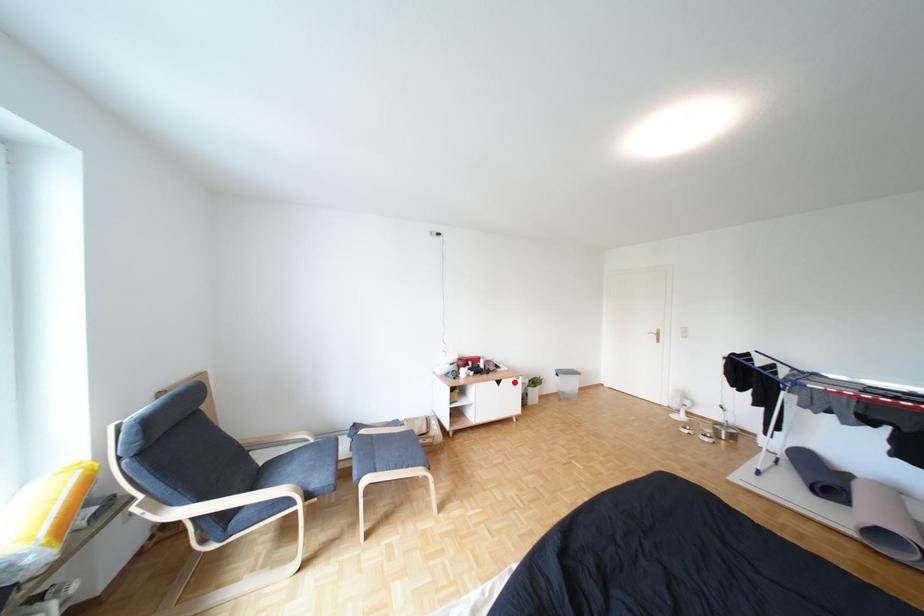
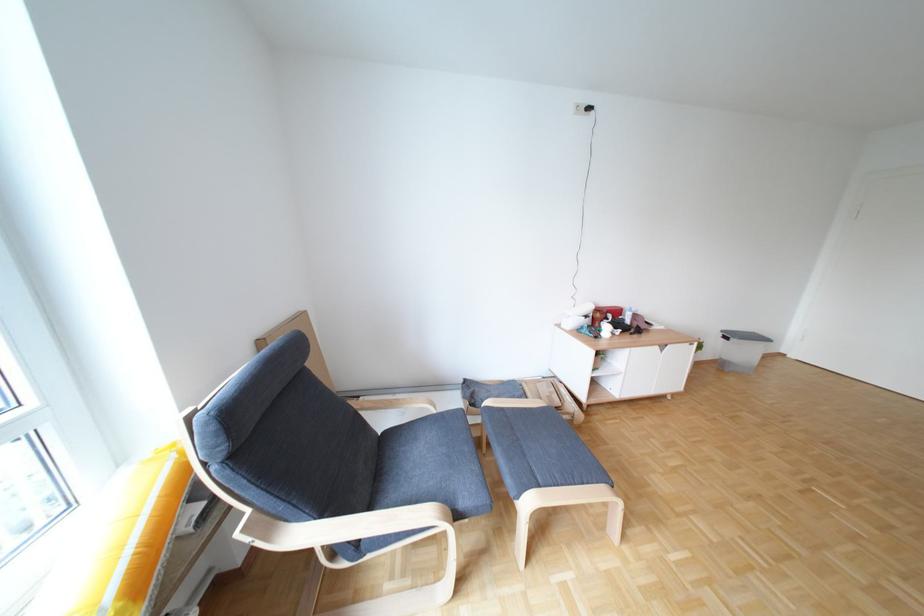
In the second image, find the point that corresponds to the highlighted location in the first image.

(678, 347)